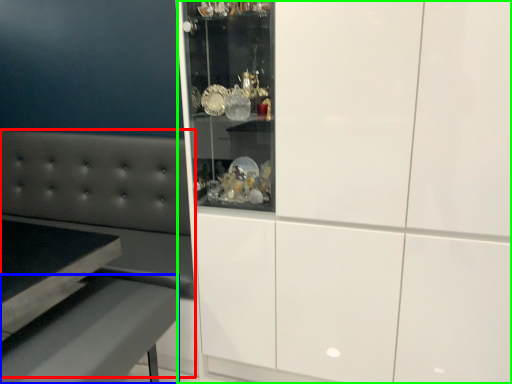
Question: Which object is the farthest from couch (highlighted by a red box)? Choose among these: table (highlighted by a blue box) or cabinetry (highlighted by a green box).

Choices:
 (A) table
 (B) cabinetry

Answer: (B)